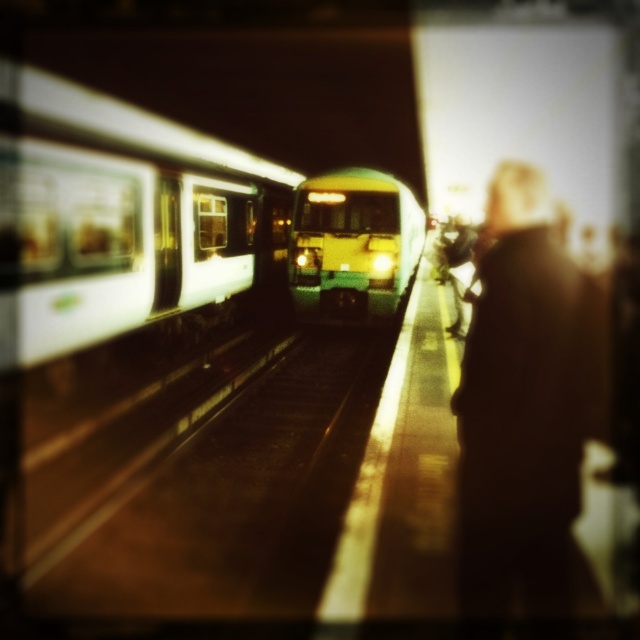
Question: Estimate the real-world distances between objects in this image. Which object is farther from the green matte train at center?

Choices:
 (A) white glossy train at left
 (B) dark brown coat at right

Answer: (B)

Question: Is white glossy train at left smaller than dark brown coat at right?

Choices:
 (A) no
 (B) yes

Answer: (B)

Question: Among these points, which one is nearest to the camera?

Choices:
 (A) (390, 228)
 (B) (500, 547)
 (C) (211, 294)

Answer: (B)

Question: Can you confirm if white glossy train at left is smaller than dark brown coat at right?

Choices:
 (A) no
 (B) yes

Answer: (B)

Question: Does white glossy train at left appear under green matte train at center?

Choices:
 (A) no
 (B) yes

Answer: (B)

Question: Which point is closer to the camera?

Choices:
 (A) green matte train at center
 (B) white glossy train at left
 (C) dark brown coat at right

Answer: (C)